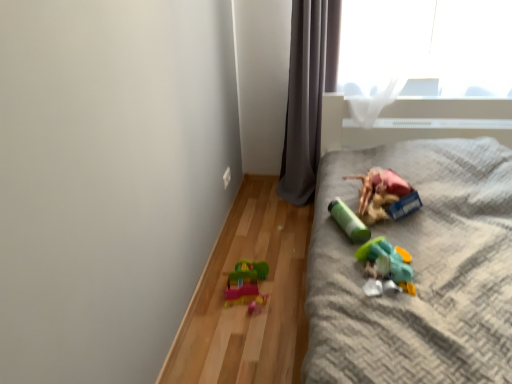
The width and height of the screenshot is (512, 384). I want to click on translucent plastic toy at lower right, acting as the 3th toy starting from the left, so click(387, 263).

What is the approximate width of translucent plastic toy at lower left, the 1th toy viewed from the left?

23.97 centimeters.

The height and width of the screenshot is (384, 512). Describe the element at coordinates (308, 94) in the screenshot. I see `gray fabric curtain at upper center` at that location.

Find the location of a particular element. This screenshot has width=512, height=384. translucent plastic toy at lower right, marked as the 2th toy in a right-to-left arrangement is located at coordinates (387, 263).

Considering the positions of point (404, 285) and point (467, 358), is point (404, 285) closer or farther from the camera than point (467, 358)?

Point (404, 285) appears to be farther away from the viewer than point (467, 358).

From a real-world perspective, does translucent plastic toy at lower right, acting as the 3th toy starting from the left, sit lower than plastic toy at right?

No, from a real-world perspective, translucent plastic toy at lower right, acting as the 3th toy starting from the left, is not under plastic toy at right.

From the picture: Can you confirm if translucent plastic toy at lower right, marked as the 2th toy in a right-to-left arrangement, is positioned to the right of plastic toy at right?

No, translucent plastic toy at lower right, marked as the 2th toy in a right-to-left arrangement, is not to the right of plastic toy at right.

Is plastic toy at right completely or partially inside translucent plastic toy at lower right, marked as the 2th toy in a right-to-left arrangement?

That's incorrect, plastic toy at right is not inside translucent plastic toy at lower right, marked as the 2th toy in a right-to-left arrangement.

Which is less distant, (x=509, y=289) or (x=251, y=297)?

The point (x=509, y=289) is more forward.

Considering the relative sizes of plastic toy at right and translucent plastic toy at lower left, acting as the fourth toy starting from the right, in the image provided, is plastic toy at right taller than translucent plastic toy at lower left, acting as the fourth toy starting from the right,?

Correct, plastic toy at right is much taller as translucent plastic toy at lower left, acting as the fourth toy starting from the right.

Between plastic toy at right and translucent plastic toy at lower left, acting as the fourth toy starting from the right, which one is positioned behind?

translucent plastic toy at lower left, acting as the fourth toy starting from the right, is further from the camera.

Is translucent plastic toy at lower right, marked as the 2th toy in a right-to-left arrangement, a part of gray fabric curtain at upper center?

No, translucent plastic toy at lower right, marked as the 2th toy in a right-to-left arrangement, is not a part of gray fabric curtain at upper center.

Based on the photo, from a real-world perspective, which is physically below, gray fabric curtain at upper center or translucent plastic toy at lower right, acting as the 3th toy starting from the left?

In real-world perspective, translucent plastic toy at lower right, acting as the 3th toy starting from the left, is lower.

Is gray fabric curtain at upper center positioned with its back to translucent plastic toy at lower right, marked as the 2th toy in a right-to-left arrangement?

No, gray fabric curtain at upper center's orientation is not away from translucent plastic toy at lower right, marked as the 2th toy in a right-to-left arrangement.

From the image's perspective, is gray fabric curtain at upper center beneath translucent plastic toy at lower right, marked as the 2th toy in a right-to-left arrangement?

No, from the image's perspective, gray fabric curtain at upper center is not beneath translucent plastic toy at lower right, marked as the 2th toy in a right-to-left arrangement.

Between point (394, 179) and point (459, 183), which one is positioned behind?

The point (459, 183) is more distant.

Which object is further away from the camera taking this photo, matte plastic toy at right, the fourth toy positioned from the left, or plastic toy at right?

matte plastic toy at right, the fourth toy positioned from the left, is further from the camera.

From a real-world perspective, which is physically below, matte plastic toy at right, the fourth toy positioned from the left, or plastic toy at right?

plastic toy at right.

Can you tell me how much matte plastic toy at right, placed as the 1th toy when sorted from right to left, and plastic toy at right differ in facing direction?

The angle between the facing direction of matte plastic toy at right, placed as the 1th toy when sorted from right to left, and the facing direction of plastic toy at right is 1.66e-05 degrees.

From the image's perspective, which object appears higher, green matte cylinder at center, the 3th toy when ordered from right to left, or gray fabric curtain at upper center?

gray fabric curtain at upper center is shown above in the image.

Consider the image. Is green matte cylinder at center, the 3th toy when ordered from right to left, outside of gray fabric curtain at upper center?

That's correct, green matte cylinder at center, the 3th toy when ordered from right to left, is outside of gray fabric curtain at upper center.

Consider the image. Between green matte cylinder at center, acting as the 2th toy starting from the left, and gray fabric curtain at upper center, which one has less height?

With less height is green matte cylinder at center, acting as the 2th toy starting from the left.

From a real-world perspective, does green matte cylinder at center, the 3th toy when ordered from right to left, stand above gray fabric curtain at upper center?

No, from a real-world perspective, green matte cylinder at center, the 3th toy when ordered from right to left, is not on top of gray fabric curtain at upper center.

Is gray fabric curtain at upper center facing away from plastic toy at right?

No, plastic toy at right is not at the back of gray fabric curtain at upper center.

Does point (317, 10) appear closer or farther from the camera than point (468, 241)?

Clearly, point (317, 10) is more distant from the camera than point (468, 241).

Is plastic toy at right inside gray fabric curtain at upper center?

Actually, plastic toy at right is outside gray fabric curtain at upper center.

You are a GUI agent. You are given a task and a screenshot of the screen. Output one action in this format:
    pyautogui.click(x=<x>, y=<y>)
    Task: Click on the furniture below the gray fabric curtain at upper center (from the image's perspective)
    Image resolution: width=512 pixels, height=384 pixels.
    Given the screenshot: What is the action you would take?
    pyautogui.click(x=417, y=271)

From the picture: Looking at their sizes, would you say plastic toy at right is wider or thinner than matte plastic toy at right, placed as the 1th toy when sorted from right to left?

plastic toy at right is wider than matte plastic toy at right, placed as the 1th toy when sorted from right to left.

From the image's perspective, between plastic toy at right and matte plastic toy at right, placed as the 1th toy when sorted from right to left, who is located below?

plastic toy at right.

Does plastic toy at right have a lesser height compared to matte plastic toy at right, placed as the 1th toy when sorted from right to left?

No, plastic toy at right is not shorter than matte plastic toy at right, placed as the 1th toy when sorted from right to left.

Is plastic toy at right further to the viewer compared to matte plastic toy at right, the fourth toy positioned from the left?

No.

This screenshot has width=512, height=384. There is a plastic toy at right. Identify the location of the 1st toy below it (from the image's perspective). (387, 263).

Locate an element on the screen. furniture that is above the translucent plastic toy at lower left, the 1th toy viewed from the left (from a real-world perspective) is located at coordinates (417, 271).

Considering their positions, is matte plastic toy at right, the fourth toy positioned from the left, positioned further to translucent plastic toy at lower right, marked as the 2th toy in a right-to-left arrangement, than plastic toy at right?

plastic toy at right lies further to translucent plastic toy at lower right, marked as the 2th toy in a right-to-left arrangement, than the other object.

Considering their positions, is translucent plastic toy at lower right, marked as the 2th toy in a right-to-left arrangement, positioned closer to matte plastic toy at right, placed as the 1th toy when sorted from right to left, than plastic toy at right?

plastic toy at right is positioned closer to the anchor matte plastic toy at right, placed as the 1th toy when sorted from right to left.

From the image, which object appears to be nearer to matte plastic toy at right, the fourth toy positioned from the left, green matte cylinder at center, acting as the 2th toy starting from the left, or translucent plastic toy at lower left, the 1th toy viewed from the left?

The object closer to matte plastic toy at right, the fourth toy positioned from the left, is green matte cylinder at center, acting as the 2th toy starting from the left.

Considering their positions, is translucent plastic toy at lower right, acting as the 3th toy starting from the left, positioned closer to green matte cylinder at center, the 3th toy when ordered from right to left, than plastic toy at right?

translucent plastic toy at lower right, acting as the 3th toy starting from the left, is closer to green matte cylinder at center, the 3th toy when ordered from right to left.

When comparing their distances from gray fabric curtain at upper center, does translucent plastic toy at lower left, acting as the fourth toy starting from the right, or translucent plastic toy at lower right, marked as the 2th toy in a right-to-left arrangement, seem closer?

translucent plastic toy at lower left, acting as the fourth toy starting from the right, is closer to gray fabric curtain at upper center.

Based on the photo, considering their positions, is green matte cylinder at center, the 3th toy when ordered from right to left, positioned closer to translucent plastic toy at lower right, marked as the 2th toy in a right-to-left arrangement, than plastic toy at right?

Among the two, green matte cylinder at center, the 3th toy when ordered from right to left, is located nearer to translucent plastic toy at lower right, marked as the 2th toy in a right-to-left arrangement.

Based on their spatial positions, is gray fabric curtain at upper center or translucent plastic toy at lower left, the 1th toy viewed from the left, further from matte plastic toy at right, the fourth toy positioned from the left?

gray fabric curtain at upper center lies further to matte plastic toy at right, the fourth toy positioned from the left, than the other object.

When comparing their distances from plastic toy at right, does gray fabric curtain at upper center or green matte cylinder at center, the 3th toy when ordered from right to left, seem closer?

green matte cylinder at center, the 3th toy when ordered from right to left, is closer to plastic toy at right.

I want to click on toy between gray fabric curtain at upper center and green matte cylinder at center, the 3th toy when ordered from right to left, from top to bottom, so click(385, 196).

Identify the location of toy between translucent plastic toy at lower left, the 1th toy viewed from the left, and translucent plastic toy at lower right, acting as the 3th toy starting from the left, in the horizontal direction. (349, 221).

This screenshot has height=384, width=512. What are the coordinates of `toy between plastic toy at right and green matte cylinder at center, the 3th toy when ordered from right to left, along the z-axis` in the screenshot? It's located at (387, 263).

In order to click on toy between translucent plastic toy at lower right, acting as the 3th toy starting from the left, and matte plastic toy at right, the fourth toy positioned from the left, in the front-back direction in this screenshot , I will do `click(349, 221)`.